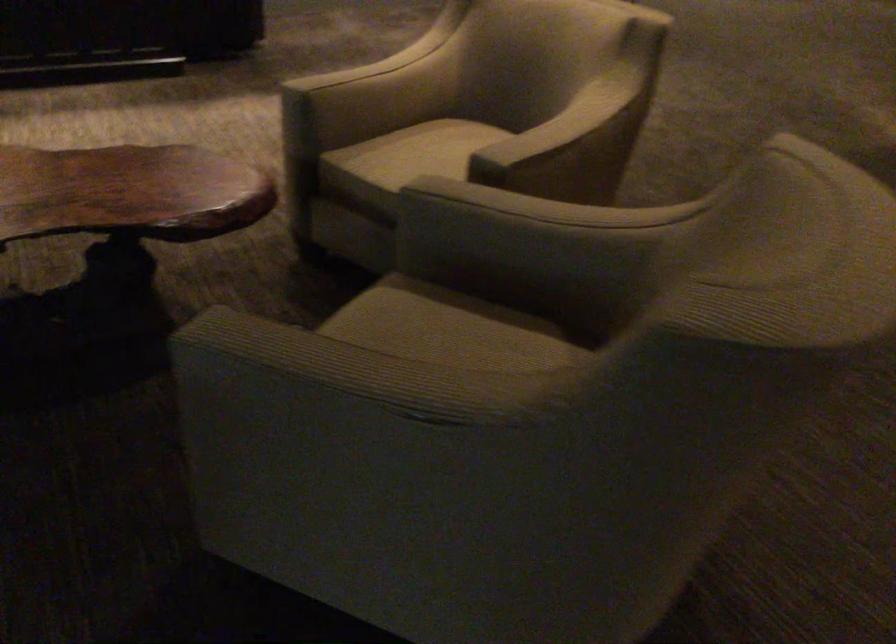
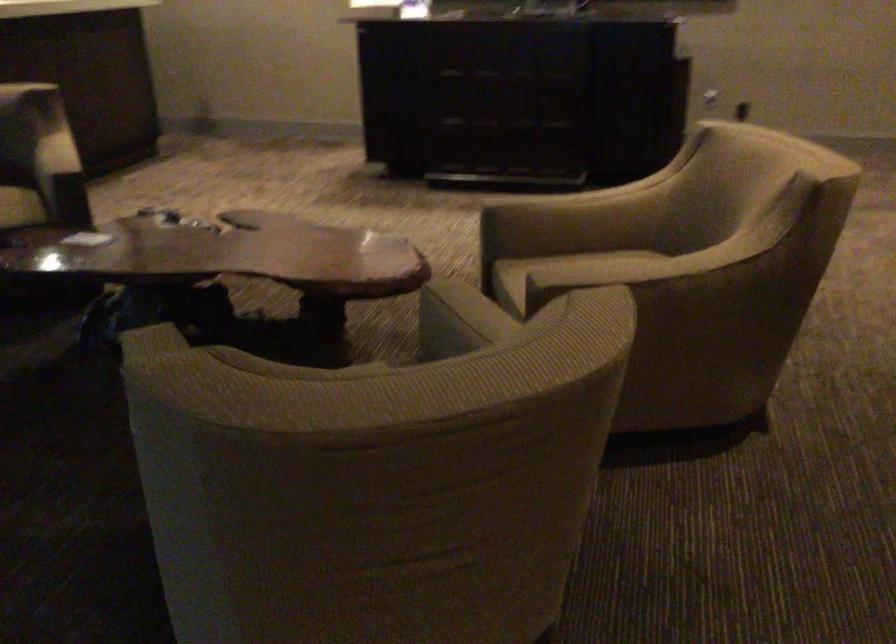
Locate, in the second image, the point that corresponds to [531,142] in the first image.

(599, 272)